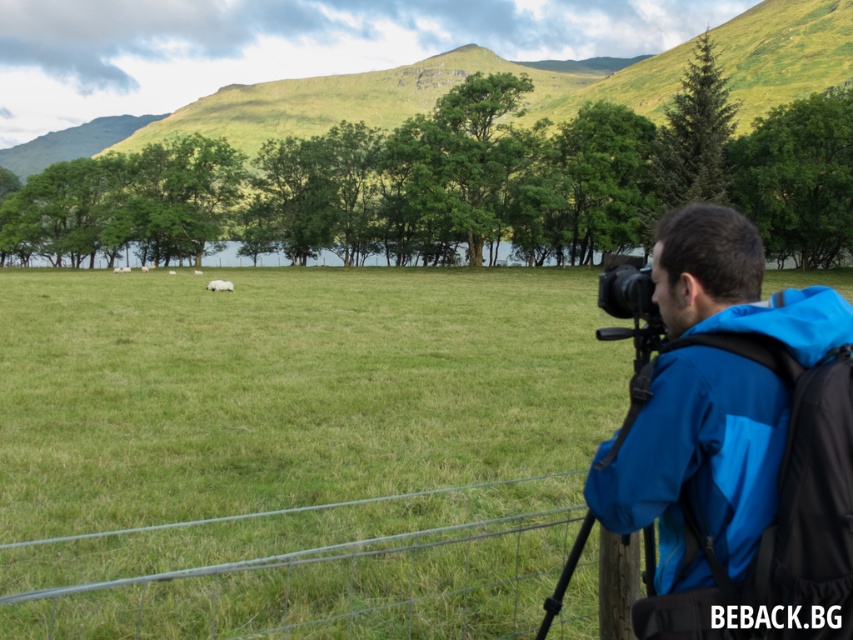
Can you confirm if black matte tripod at right is thinner than black plastic camera at right?

Yes, black matte tripod at right is thinner than black plastic camera at right.

Looking at this image, which is more to the left, black matte tripod at right or black plastic camera at right?

From the viewer's perspective, black matte tripod at right appears more on the left side.

Is point (558, 608) behind point (624, 266)?

Yes.

The width and height of the screenshot is (853, 640). I want to click on black matte tripod at right, so click(x=634, y=368).

In the scene shown: Does green grassy field at center have a greater width compared to black plastic camera at right?

Yes, green grassy field at center is wider than black plastic camera at right.

This screenshot has width=853, height=640. What are the coordinates of `green grassy field at center` in the screenshot? It's located at (288, 387).

Consider the image. Who is taller, wire mesh fence at lower center or black matte tripod at right?

With more height is black matte tripod at right.

What do you see at coordinates (306, 570) in the screenshot?
I see `wire mesh fence at lower center` at bounding box center [306, 570].

Where is `wire mesh fence at lower center`? wire mesh fence at lower center is located at coordinates [306, 570].